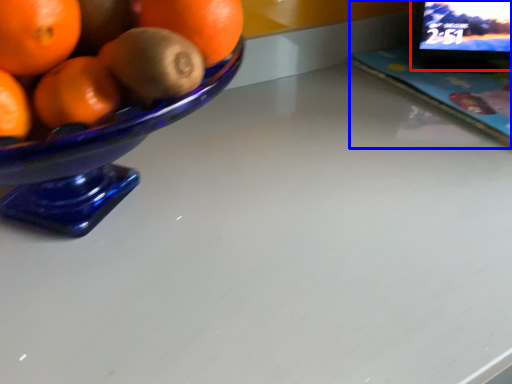
Question: Among these objects, which one is nearest to the camera, computer monitor (highlighted by a red box) or laptop (highlighted by a blue box)?

Choices:
 (A) computer monitor
 (B) laptop

Answer: (B)